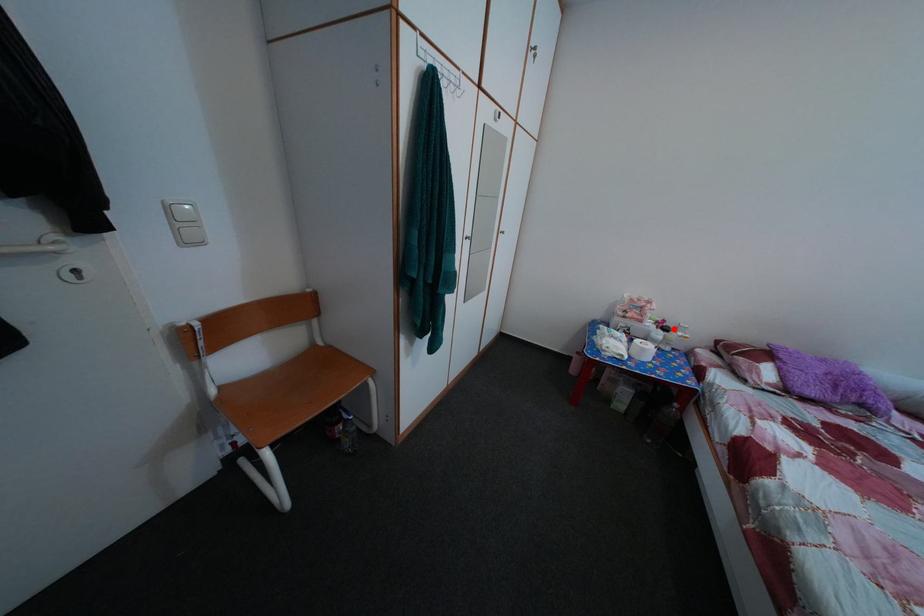
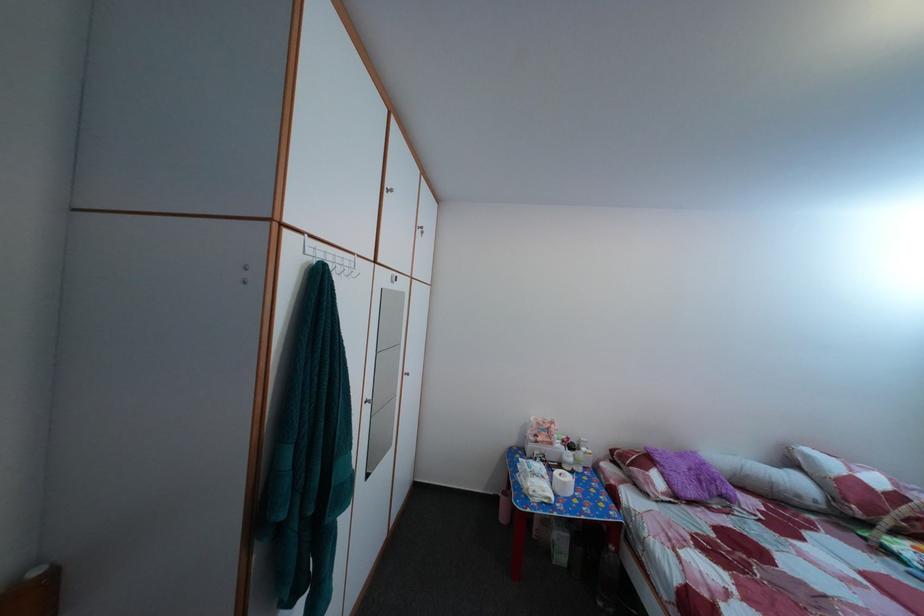
Question: I am providing you with two images of the same scene from different viewpoints. A red point is marked on the first image. At the location where the point appears in image 1, is it still visible in image 2?

Choices:
 (A) Yes
 (B) No

Answer: (A)